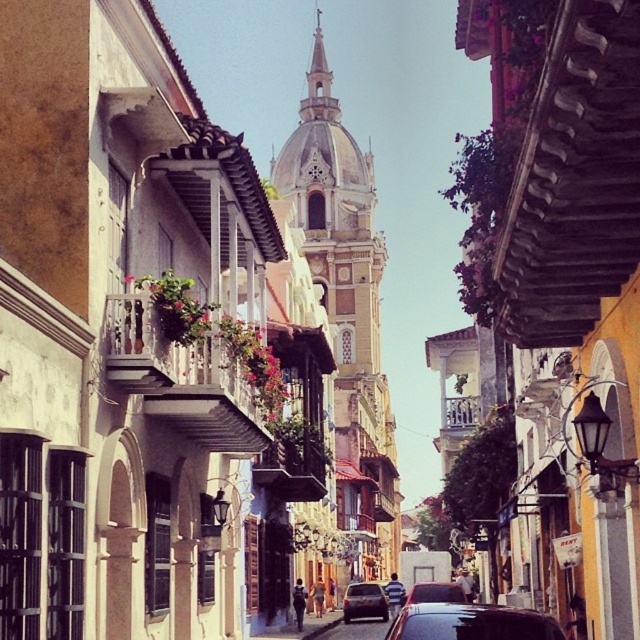
Who is more forward, (x=429, y=598) or (x=404, y=596)?

Positioned in front is point (x=429, y=598).

Consider the image. Is shiny black sedan at center to the right of metallic silver car at center from the viewer's perspective?

Correct, you'll find shiny black sedan at center to the right of metallic silver car at center.

The width and height of the screenshot is (640, 640). In order to click on shiny black sedan at center in this screenshot , I will do `click(435, 593)`.

Who is higher up, shiny black car at center or shiny black sedan at center?

shiny black car at center

Is shiny black car at center positioned behind shiny black sedan at center?

That is False.

Who is more forward, (468,605) or (435,600)?

Point (468,605) is in front.

You are a GUI agent. You are given a task and a screenshot of the screen. Output one action in this format:
    pyautogui.click(x=<x>, y=<y>)
    Task: Click on the shiny black car at center
    
    Given the screenshot: What is the action you would take?
    pyautogui.click(x=472, y=621)

From the picture: Between shiny black car at center and matte black car at center, which one is positioned higher?

shiny black car at center is higher up.

Can you confirm if shiny black car at center is positioned below matte black car at center?

No.

Locate an element on the screen. The width and height of the screenshot is (640, 640). shiny black car at center is located at coordinates (472, 621).